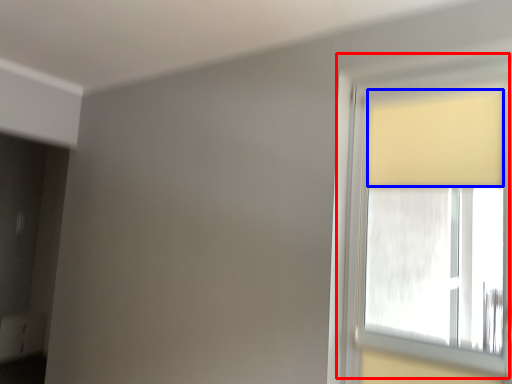
Question: Which of the following is the farthest to the observer, window (highlighted by a red box) or curtain (highlighted by a blue box)?

Choices:
 (A) window
 (B) curtain

Answer: (B)